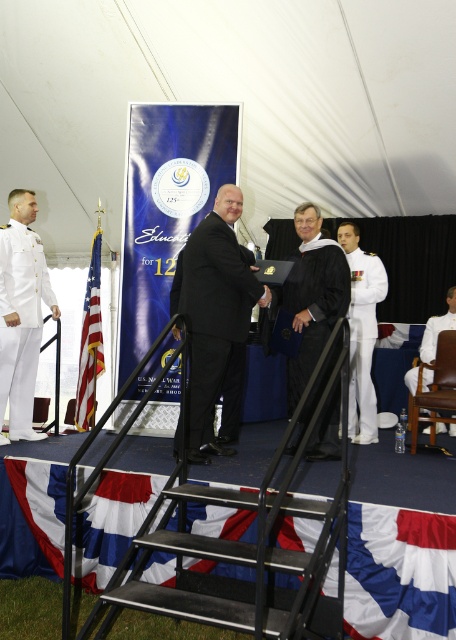
Between red fabric flag at center and american flag at left, which one has less height?

With less height is red fabric flag at center.

In the scene shown: Which is more to the left, red fabric flag at center or american flag at left?

american flag at left

The height and width of the screenshot is (640, 456). Find the location of `red fabric flag at center`. red fabric flag at center is located at coordinates (399, 573).

I want to click on red fabric flag at center, so click(x=399, y=573).

Does black metal/stainless steel ladder at center have a larger size compared to white cotton uniform at center?

Indeed, black metal/stainless steel ladder at center has a larger size compared to white cotton uniform at center.

Is point (175, 480) farther from viewer compared to point (352, 380)?

That is False.

Where is `black metal/stainless steel ladder at center`? This screenshot has width=456, height=640. black metal/stainless steel ladder at center is located at coordinates (248, 541).

From the picture: Between white cotton pants at left and white cotton uniform at center, which one has less height?

Standing shorter between the two is white cotton pants at left.

Is white cotton pants at left to the right of white cotton uniform at center from the viewer's perspective?

Answer: In fact, white cotton pants at left is to the left of white cotton uniform at center.

Who is more forward, (20, 394) or (351, 321)?

Point (20, 394) is in front.

This screenshot has width=456, height=640. I want to click on white cotton pants at left, so click(20, 321).